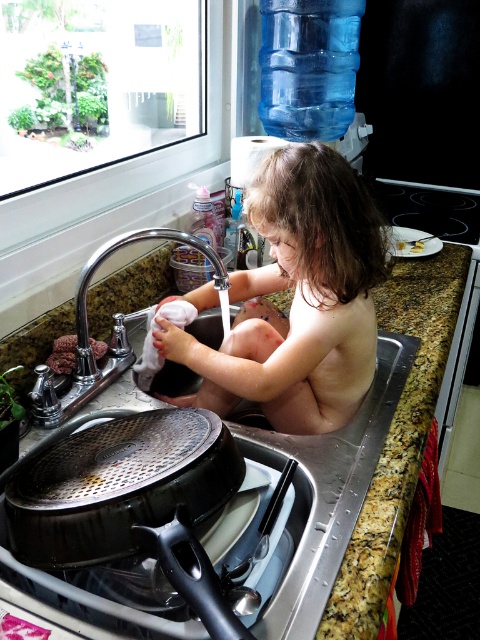
You are standing in the kitchen and want to reach a point that is exactly 1.09 meters away from you. Can you confirm if the point at coordinates point (410, 410) is at that distance?

The distance of point (410, 410) from viewer is 1.09 meters, so yes, the point at coordinates point 0.642, 0.846 is exactly 1.09 meters away from you.

You are a parent trying to clean the kitchen sink. You see the silver metallic faucet at upper left and the brown crumbly food at sink left. Which object is wider?

The silver metallic faucet at upper left is wider than the brown crumbly food at sink left.

You are standing in the kitchen and want to place a small toy between the two points labeled point (264,355) and point (149,268). Which point should the toy be closer to if you want it to appear larger in your view?

The toy should be placed closer to point (264,355) because it is closer to the camera, making objects placed there appear larger in your view.